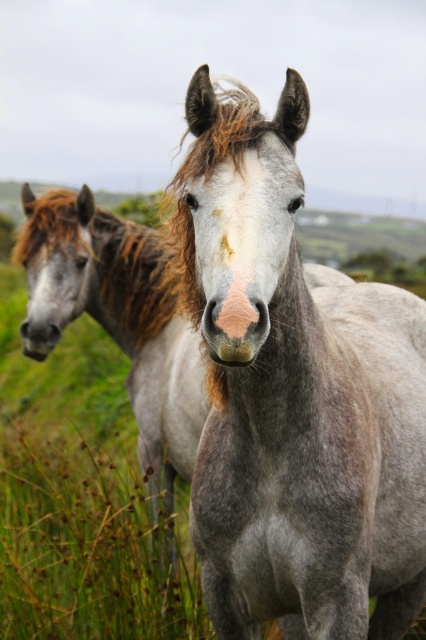
Question: Is gray matte horse at center positioned before gray matte horse at left?

Choices:
 (A) no
 (B) yes

Answer: (B)

Question: Among these objects, which one is farthest from the camera?

Choices:
 (A) gray matte horse at left
 (B) brown fuzzy mane at left
 (C) gray matte horse at center

Answer: (B)

Question: Does gray matte horse at center appear on the right side of brown fuzzy mane at left?

Choices:
 (A) no
 (B) yes

Answer: (B)

Question: Which point is farther from the camera taking this photo?

Choices:
 (A) (109, 260)
 (B) (236, 268)

Answer: (A)

Question: Among these points, which one is farthest from the camera?

Choices:
 (A) (83, 232)
 (B) (230, 273)
 (C) (161, 269)

Answer: (C)

Question: Is gray matte horse at center smaller than brown fuzzy mane at left?

Choices:
 (A) yes
 (B) no

Answer: (B)